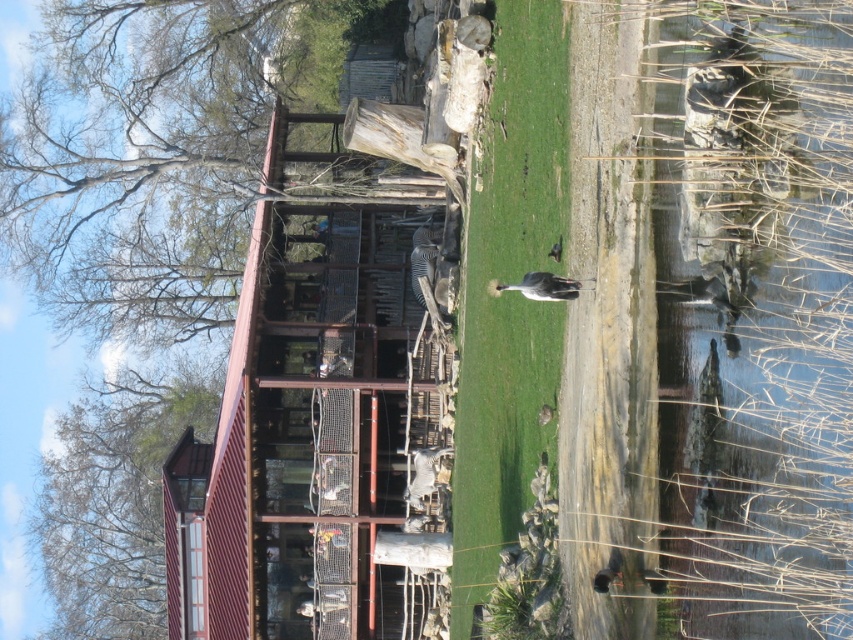
You are a zookeeper planning to distribute food to the animals. You have two areas to consider for feeding stations. The clear water at right and the green grass at center. Based on their widths, which area can accommodate a wider feeding station?

The green grass at center can accommodate a wider feeding station because its width is greater than the clear water at right.